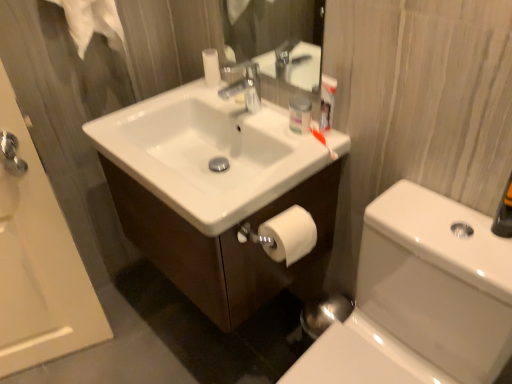
Measure the distance between white matte toilet paper at lower right and camera.

They are 39.10 inches apart.

Identify the location of white glossy bathtub at upper left. The width and height of the screenshot is (512, 384). (37, 258).

Describe the element at coordinates (207, 154) in the screenshot. This screenshot has height=384, width=512. I see `white glossy sink at center` at that location.

Locate an element on the screen. white matte toilet paper at lower right is located at coordinates (288, 235).

In terms of height, does white glossy sink at center look taller or shorter compared to matte plastic container at upper center?

Considering their sizes, white glossy sink at center has more height than matte plastic container at upper center.

From a real-world perspective, is white glossy sink at center under matte plastic container at upper center?

Yes, from a real-world perspective, white glossy sink at center is under matte plastic container at upper center.

Can you tell me how much white glossy sink at center and matte plastic container at upper center differ in facing direction?

The angular difference between white glossy sink at center and matte plastic container at upper center is 1.43 degrees.

Considering the relative positions of white glossy sink at center and matte plastic container at upper center in the image provided, is white glossy sink at center to the left of matte plastic container at upper center from the viewer's perspective?

Yes, white glossy sink at center is to the left of matte plastic container at upper center.

Is white matte toilet paper at lower right placed right next to white glossy sink at center?

white matte toilet paper at lower right and white glossy sink at center are not in contact.

Is white matte toilet paper at lower right completely or partially outside of white glossy sink at center?

white matte toilet paper at lower right lies outside white glossy sink at center's area.

Find the location of a particular element. toilet paper that is on the right side of white glossy sink at center is located at coordinates (288, 235).

Which is in front, white glossy cabinet at center or white matte toilet paper at lower right?

white matte toilet paper at lower right is closer to the camera.

Is white matte toilet paper at lower right at the back of white glossy cabinet at center?

No.

Considering the sizes of white glossy cabinet at center and white matte toilet paper at lower right in the image, is white glossy cabinet at center bigger or smaller than white matte toilet paper at lower right?

white glossy cabinet at center is bigger than white matte toilet paper at lower right.

Locate an element on the screen. The height and width of the screenshot is (384, 512). toilet paper lying on the right of white glossy cabinet at center is located at coordinates (288, 235).

Is white glossy toilet bowl at lower right wider or thinner than white glossy cabinet at center?

In the image, white glossy toilet bowl at lower right appears to be wider than white glossy cabinet at center.

From the image's perspective, would you say white glossy toilet bowl at lower right is positioned over white glossy cabinet at center?

No, from the image's perspective, white glossy toilet bowl at lower right is not on top of white glossy cabinet at center.

Is white glossy toilet bowl at lower right oriented away from white glossy cabinet at center?

white glossy toilet bowl at lower right is not turned away from white glossy cabinet at center.

Would you say white glossy toilet bowl at lower right is inside or outside white glossy cabinet at center?

white glossy toilet bowl at lower right is outside white glossy cabinet at center.

How different are the orientations of white glossy cabinet at center and matte plastic container at upper center in degrees?

The angle between the facing direction of white glossy cabinet at center and the facing direction of matte plastic container at upper center is 1.16 degrees.

Looking at this image, between white glossy cabinet at center and matte plastic container at upper center, which one is positioned behind?

matte plastic container at upper center is behind.

From a real-world perspective, is white glossy cabinet at center physically located above or below matte plastic container at upper center?

From a real-world perspective, white glossy cabinet at center is physically below matte plastic container at upper center.

Considering the sizes of objects white glossy cabinet at center and matte plastic container at upper center in the image provided, who is smaller, white glossy cabinet at center or matte plastic container at upper center?

With smaller size is matte plastic container at upper center.

Measure the distance from white glossy cabinet at center to white glossy bathtub at upper left.

white glossy cabinet at center is 46.34 centimeters away from white glossy bathtub at upper left.

Considering the sizes of objects white glossy cabinet at center and white glossy bathtub at upper left in the image provided, who is smaller, white glossy cabinet at center or white glossy bathtub at upper left?

With smaller size is white glossy bathtub at upper left.

The height and width of the screenshot is (384, 512). In the image, there is a white glossy bathtub at upper left. In order to click on bathroom cabinet above it (from the image's perspective) in this screenshot , I will do `click(227, 247)`.

From the image's perspective, between white glossy toilet bowl at lower right and matte plastic container at upper center, who is located below?

From the image's view, white glossy toilet bowl at lower right is below.

Considering the positions of objects white glossy toilet bowl at lower right and matte plastic container at upper center in the image provided, who is more to the right, white glossy toilet bowl at lower right or matte plastic container at upper center?

From the viewer's perspective, white glossy toilet bowl at lower right appears more on the right side.

In terms of height, does white glossy toilet bowl at lower right look taller or shorter compared to matte plastic container at upper center?

white glossy toilet bowl at lower right is taller than matte plastic container at upper center.

Where is `sink below the matte plastic container at upper center (from the image's perspective)`? sink below the matte plastic container at upper center (from the image's perspective) is located at coordinates click(x=207, y=154).

At what (x,y) coordinates should I click in order to perform the action: click on sink above the white matte toilet paper at lower right (from a real-world perspective). Please return your answer as a coordinate pair (x, y). The image size is (512, 384). Looking at the image, I should click on (207, 154).

From the image, which object appears to be farther from white glossy toilet bowl at lower right, white glossy cabinet at center or white glossy bathtub at upper left?

white glossy bathtub at upper left is positioned further to the anchor white glossy toilet bowl at lower right.

Considering their positions, is white glossy cabinet at center positioned closer to white glossy toilet bowl at lower right than white matte toilet paper at lower right?

white matte toilet paper at lower right lies closer to white glossy toilet bowl at lower right than the other object.

Based on their spatial positions, is white glossy bathtub at upper left or white glossy cabinet at center closer to white matte toilet paper at lower right?

The object closer to white matte toilet paper at lower right is white glossy cabinet at center.

Looking at the image, which one is located further to white glossy cabinet at center, matte plastic container at upper center or white matte toilet paper at lower right?

matte plastic container at upper center is further to white glossy cabinet at center.

Considering their positions, is white glossy cabinet at center positioned closer to white matte toilet paper at lower right than white glossy toilet bowl at lower right?

The object closer to white matte toilet paper at lower right is white glossy cabinet at center.

When comparing their distances from matte plastic container at upper center, does white glossy toilet bowl at lower right or white glossy sink at center seem further?

white glossy toilet bowl at lower right.

From the image, which object appears to be farther from white glossy cabinet at center, white glossy sink at center or white matte toilet paper at lower right?

white matte toilet paper at lower right is further to white glossy cabinet at center.

Estimate the real-world distances between objects in this image. Which object is further from white glossy cabinet at center, white glossy sink at center or matte plastic container at upper center?

matte plastic container at upper center is positioned further to the anchor white glossy cabinet at center.

Identify the location of bathroom cabinet between matte plastic container at upper center and white glossy toilet bowl at lower right in the vertical direction. This screenshot has height=384, width=512. (227, 247).

In order to click on toilet paper between white glossy bathtub at upper left and white glossy toilet bowl at lower right in this screenshot , I will do `click(288, 235)`.

Locate an element on the screen. This screenshot has width=512, height=384. sink between white glossy bathtub at upper left and white glossy toilet bowl at lower right in the horizontal direction is located at coordinates (207, 154).

Where is `toilet paper between white glossy cabinet at center and white glossy toilet bowl at lower right vertically`? toilet paper between white glossy cabinet at center and white glossy toilet bowl at lower right vertically is located at coordinates (288, 235).